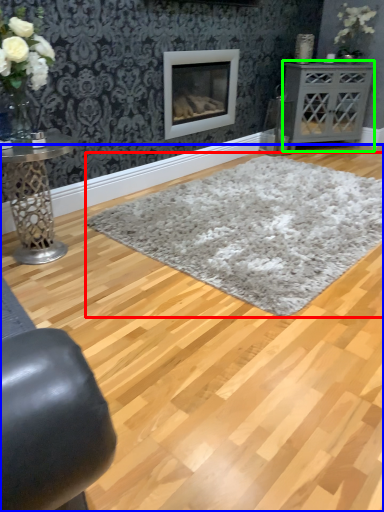
Question: Which object is positioned farthest from plain (highlighted by a red box)? Select from plain (highlighted by a blue box) and table (highlighted by a green box).

Choices:
 (A) plain
 (B) table

Answer: (B)